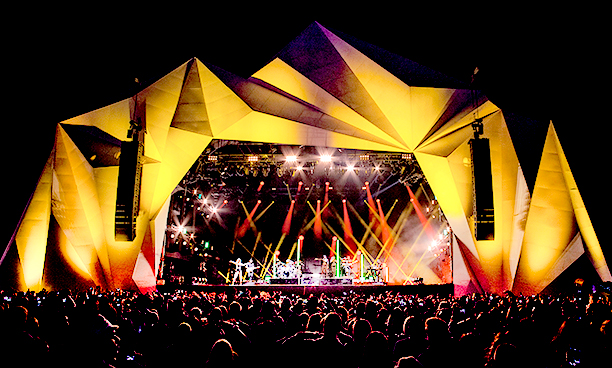
This screenshot has height=368, width=612. In order to click on keyboard in this screenshot , I will do `click(374, 269)`.